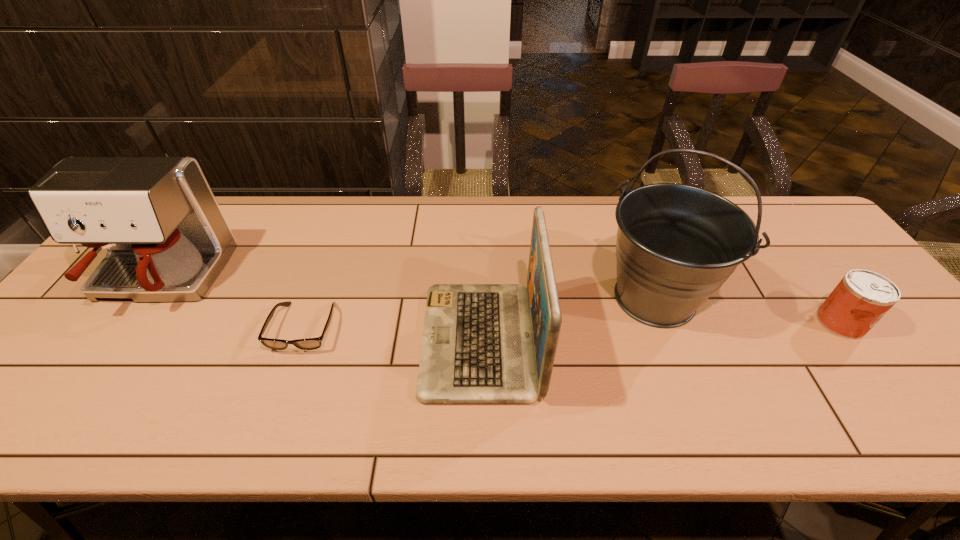
Where is `free spot located on the screen of the laptop computer`? free spot located on the screen of the laptop computer is located at coordinates (273, 340).

Find the location of `free point located 0.090m on the screen of the laptop computer`. free point located 0.090m on the screen of the laptop computer is located at coordinates (385, 340).

Image resolution: width=960 pixels, height=540 pixels. Find the location of `free location located on the screen of the laptop computer`. free location located on the screen of the laptop computer is located at coordinates (344, 340).

You are a GUI agent. You are given a task and a screenshot of the screen. Output one action in this format:
    pyautogui.click(x=<x>, y=<y>)
    Task: Click on the free location located on the front of the can
    
    Given the screenshot: What is the action you would take?
    pyautogui.click(x=901, y=404)

What are the coordinates of `free space located 0.050m on the lenses of the fourth object from right to left` in the screenshot? It's located at (288, 374).

Locate an element on the screen. The height and width of the screenshot is (540, 960). object located at the near edge is located at coordinates (482, 343).

You are a GUI agent. You are given a task and a screenshot of the screen. Output one action in this format:
    pyautogui.click(x=<x>, y=<y>)
    Task: Click on the object at the left edge
    The image size is (960, 540).
    Given the screenshot: What is the action you would take?
    pyautogui.click(x=167, y=239)

Locate an element on the screen. This screenshot has width=960, height=540. object that is at the right edge is located at coordinates (862, 297).

Where is `vacant space at the far edge of the desktop`? The height and width of the screenshot is (540, 960). vacant space at the far edge of the desktop is located at coordinates (268, 244).

You are a GUI agent. You are given a task and a screenshot of the screen. Output one action in this format:
    pyautogui.click(x=<x>, y=<y>)
    Task: Click on the vacant space at the near edge of the desktop
    
    Given the screenshot: What is the action you would take?
    pyautogui.click(x=396, y=433)